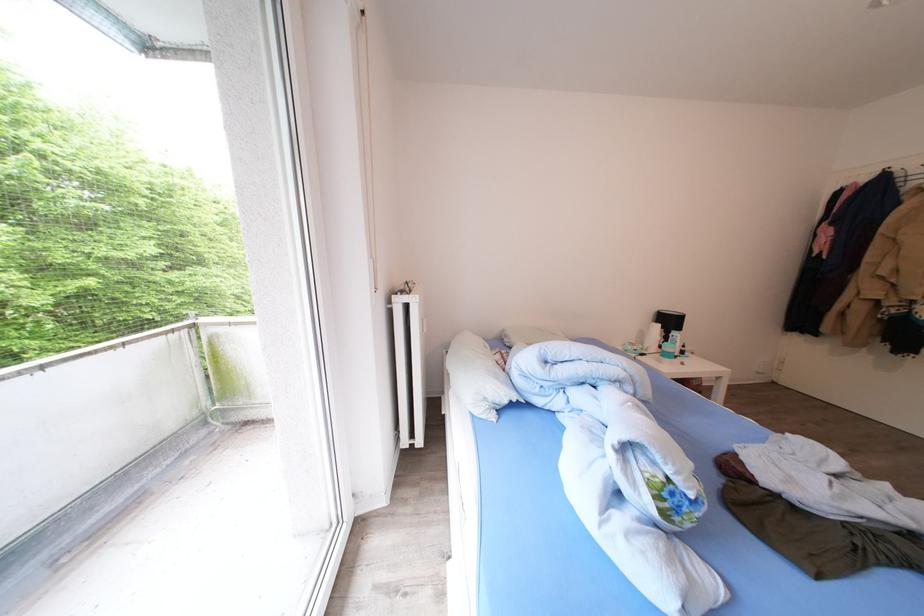
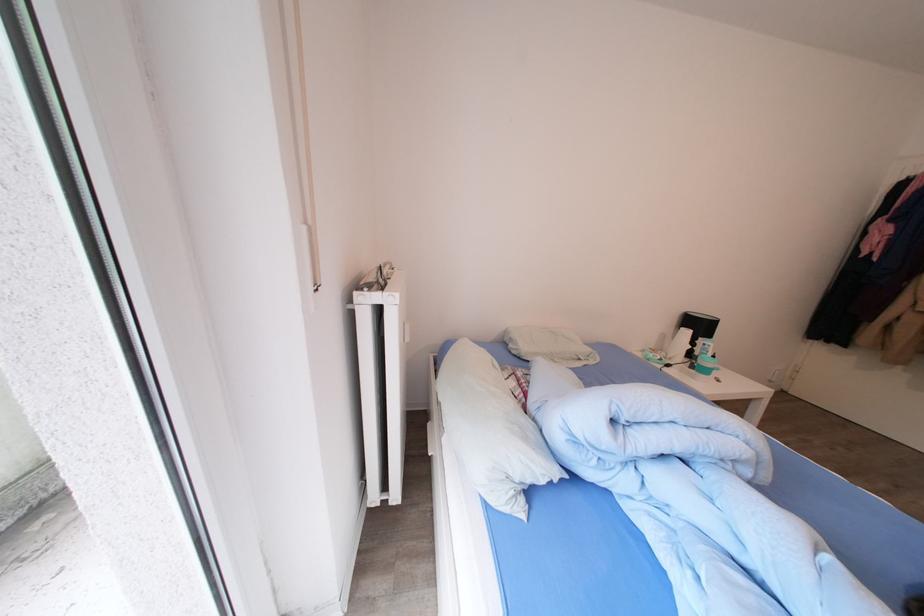
Question: The images are taken continuously from a first-person perspective. In which direction is your viewpoint rotating?

Choices:
 (A) Left
 (B) Right
 (C) Up
 (D) Down

Answer: (D)